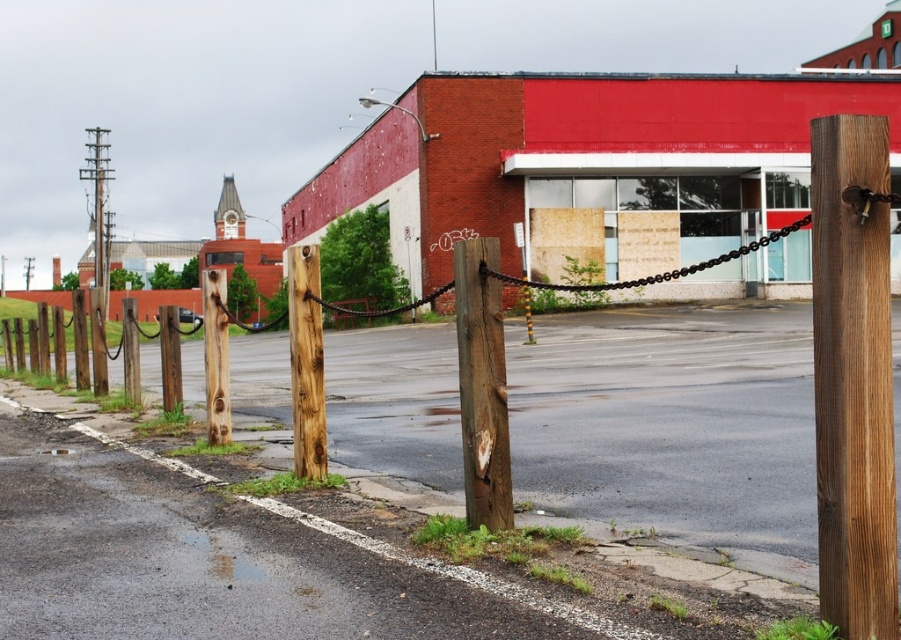
Who is positioned more to the right, weathered wood post at center or natural wood post at center?

weathered wood post at center is more to the right.

Is weathered wood post at center to the right of natural wood post at center from the viewer's perspective?

Yes, weathered wood post at center is to the right of natural wood post at center.

Between point (463, 317) and point (317, 461), which one is positioned in front?

Point (463, 317) is more forward.

Identify the location of weathered wood post at center. (481, 385).

Who is higher up, brown rough wood post at left or smooth brown wooden telegraph pole at left?

smooth brown wooden telegraph pole at left

The height and width of the screenshot is (640, 901). What do you see at coordinates (216, 356) in the screenshot?
I see `brown rough wood post at left` at bounding box center [216, 356].

Locate an element on the screen. The width and height of the screenshot is (901, 640). brown rough wood post at left is located at coordinates (216, 356).

Is dark brown wood post at center to the left of smooth brown wooden telegraph pole at left from the viewer's perspective?

In fact, dark brown wood post at center is to the right of smooth brown wooden telegraph pole at left.

You are a GUI agent. You are given a task and a screenshot of the screen. Output one action in this format:
    pyautogui.click(x=<x>, y=<y>)
    Task: Click on the dark brown wood post at center
    
    Given the screenshot: What is the action you would take?
    pyautogui.click(x=853, y=376)